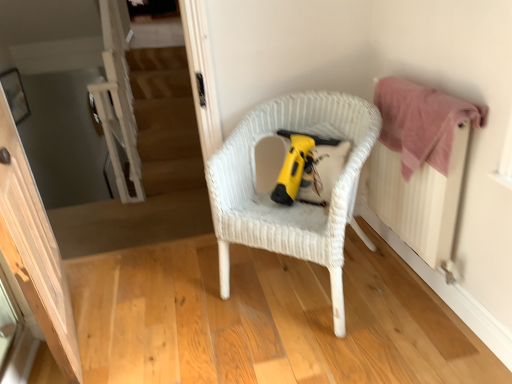
Where is `vacant area that is situated to the right of transparent glass screen door at left`? The image size is (512, 384). vacant area that is situated to the right of transparent glass screen door at left is located at coordinates (153, 320).